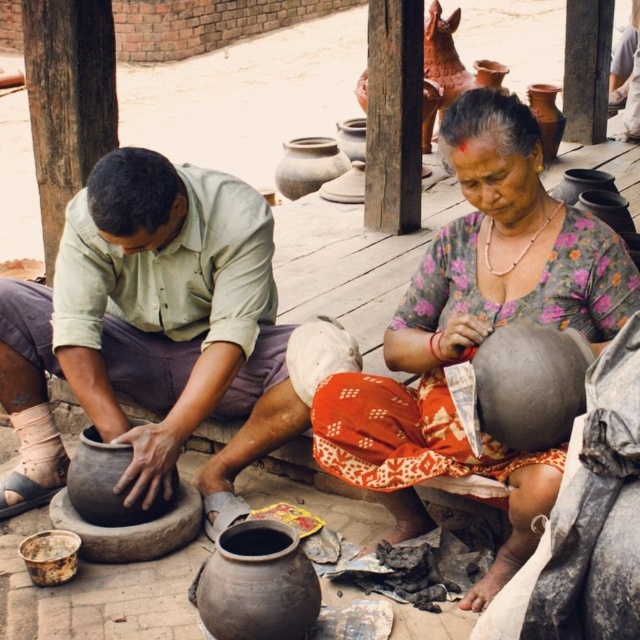
Does matte clay pot at left appear on the left side of rusty metal bucket at lower left?

In fact, matte clay pot at left is to the right of rusty metal bucket at lower left.

Who is lower down, matte clay pot at left or rusty metal bucket at lower left?

rusty metal bucket at lower left

Based on the photo, who is more distant from viewer, (x=161, y=371) or (x=42, y=563)?

The point (x=161, y=371) is more distant.

Where is `matte clay pot at left`? The height and width of the screenshot is (640, 640). matte clay pot at left is located at coordinates (150, 332).

Does point (100, 196) come in front of point (204, 573)?

That is False.

Which is more to the right, matte clay pot at left or matte clay pot at center?

matte clay pot at center is more to the right.

I want to click on matte clay pot at left, so click(150, 332).

Which is below, matte clay pot at center or rusty metal bucket at lower left?

matte clay pot at center is below.

Can you confirm if matte clay pot at center is smaller than rusty metal bucket at lower left?

Incorrect, matte clay pot at center is not smaller in size than rusty metal bucket at lower left.

Between point (250, 564) and point (65, 573), which one is positioned behind?

Positioned behind is point (65, 573).

Find the location of a particular element. matte clay pot at center is located at coordinates [x=257, y=584].